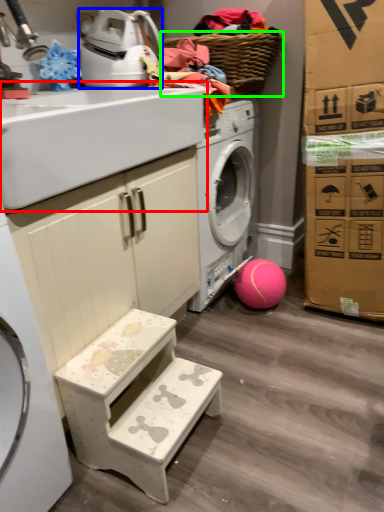
Question: Which object is the farthest from sink (highlighted by a red box)? Choose among these: appliance (highlighted by a blue box) or basket (highlighted by a green box).

Choices:
 (A) appliance
 (B) basket

Answer: (B)